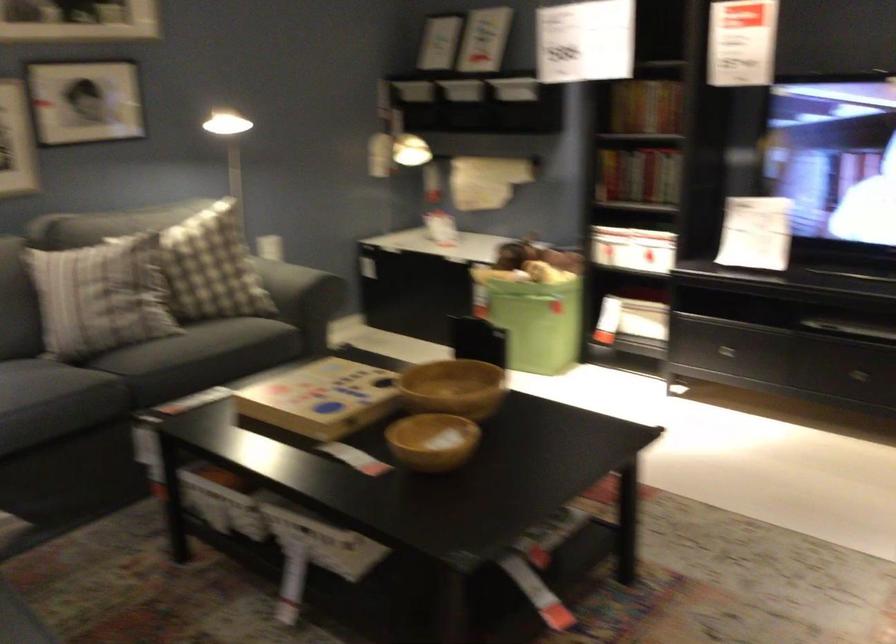
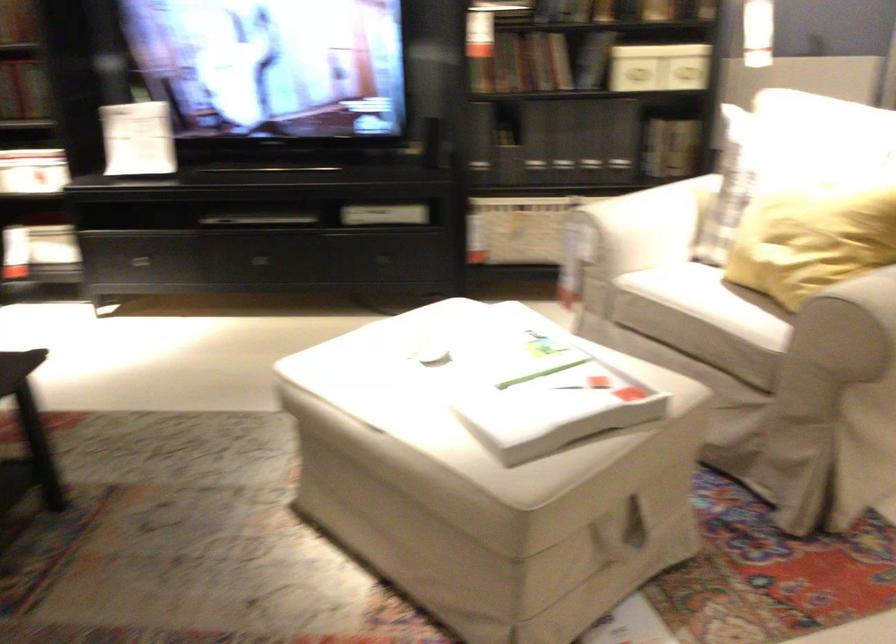
Question: How did the camera likely rotate?

Choices:
 (A) Left
 (B) Right
 (C) Up
 (D) Down

Answer: (B)